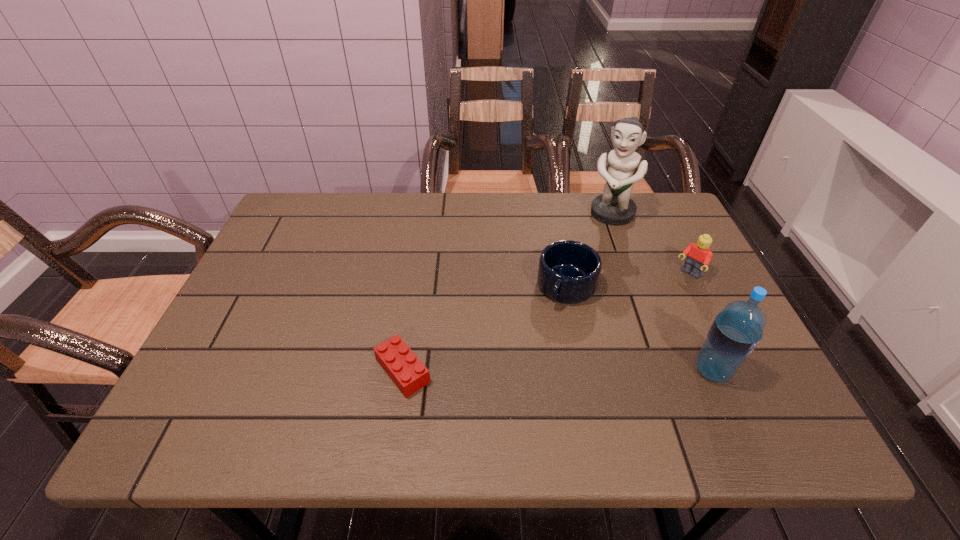
You are a GUI agent. You are given a task and a screenshot of the screen. Output one action in this format:
    pyautogui.click(x=<x>, y=<y>)
    Task: Click on the vacant region at the left edge of the desktop
    Image resolution: width=960 pixels, height=540 pixels.
    Given the screenshot: What is the action you would take?
    pyautogui.click(x=220, y=339)

Identify the location of vacant space at the far left corner of the desktop. (301, 194).

You are a GUI agent. You are given a task and a screenshot of the screen. Output one action in this format:
    pyautogui.click(x=<x>, y=<y>)
    Task: Click on the free space at the far right corner of the desktop
    The width and height of the screenshot is (960, 540).
    Given the screenshot: What is the action you would take?
    pyautogui.click(x=646, y=202)

Locate an element on the screen. This screenshot has height=540, width=960. free space between the water bottle and the right Lego is located at coordinates (700, 322).

This screenshot has width=960, height=540. Identify the location of vacant point located between the fourth object from right to left and the third tallest object. (628, 281).

Find the location of a particular element. This screenshot has height=540, width=960. unoccupied position between the fourth object from right to left and the fourth shortest object is located at coordinates (639, 329).

Locate an element on the screen. The width and height of the screenshot is (960, 540). vacant space that's between the fourth shortest object and the second object from left to right is located at coordinates (639, 329).

Find the location of `vacant area between the right Lego and the farthest object`. vacant area between the right Lego and the farthest object is located at coordinates (650, 245).

This screenshot has height=540, width=960. Find the location of `vacant area that lies between the leftmost object and the mug`. vacant area that lies between the leftmost object and the mug is located at coordinates (485, 329).

The width and height of the screenshot is (960, 540). I want to click on free area in between the farther Lego and the nearer Lego, so click(x=545, y=323).